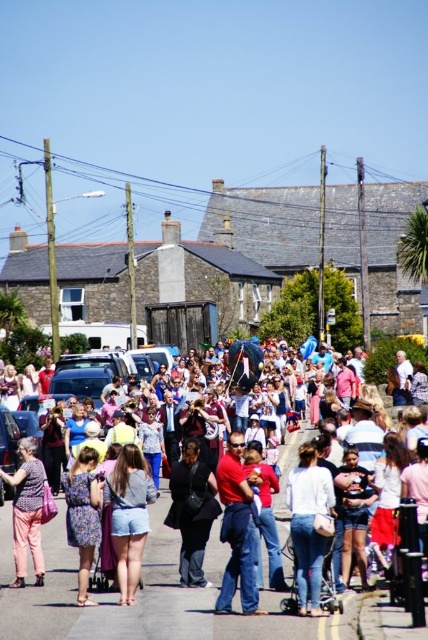
Question: Based on their relative distances, which object is nearer to the denim shorts at center?

Choices:
 (A) black matte jacket at center
 (B) white cotton crowd at center
 (C) dusty purple dress at lower left
 (D) red cotton shirt at center

Answer: (C)

Question: Is black matte jacket at center to the left of floral fabric dress at lower left from the viewer's perspective?

Choices:
 (A) yes
 (B) no

Answer: (B)

Question: Can you confirm if denim shorts at center is positioned to the right of dusty purple dress at lower left?

Choices:
 (A) no
 (B) yes

Answer: (B)

Question: Which of the following is the farthest from the observer?

Choices:
 (A) (68, 538)
 (B) (51, 636)
 (C) (249, 493)

Answer: (C)

Question: Considering the relative positions of white cotton crowd at center and white cotton shirt at center in the image provided, where is white cotton crowd at center located with respect to white cotton shirt at center?

Choices:
 (A) above
 (B) below

Answer: (B)

Question: Among these objects, which one is farthest from the camera?

Choices:
 (A) red cotton shirt at center
 (B) dusty purple dress at lower left

Answer: (B)